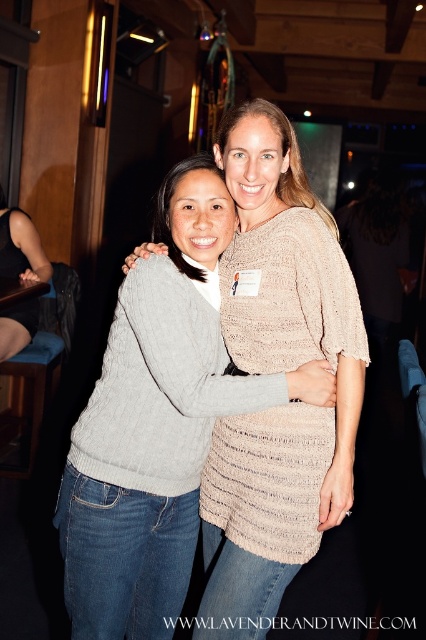
In the scene shown: Does gray knitted sweater at center have a larger size compared to matte gray sweater at lower left?

Indeed, gray knitted sweater at center has a larger size compared to matte gray sweater at lower left.

Is point (215, 193) closer to camera compared to point (25, 248)?

Yes, it is in front of point (25, 248).

Is point (173, 317) less distant than point (14, 230)?

That is True.

You are a GUI agent. You are given a task and a screenshot of the screen. Output one action in this format:
    pyautogui.click(x=<x>, y=<y>)
    Task: Click on the gray knitted sweater at center
    
    Given the screenshot: What is the action you would take?
    pyautogui.click(x=158, y=422)